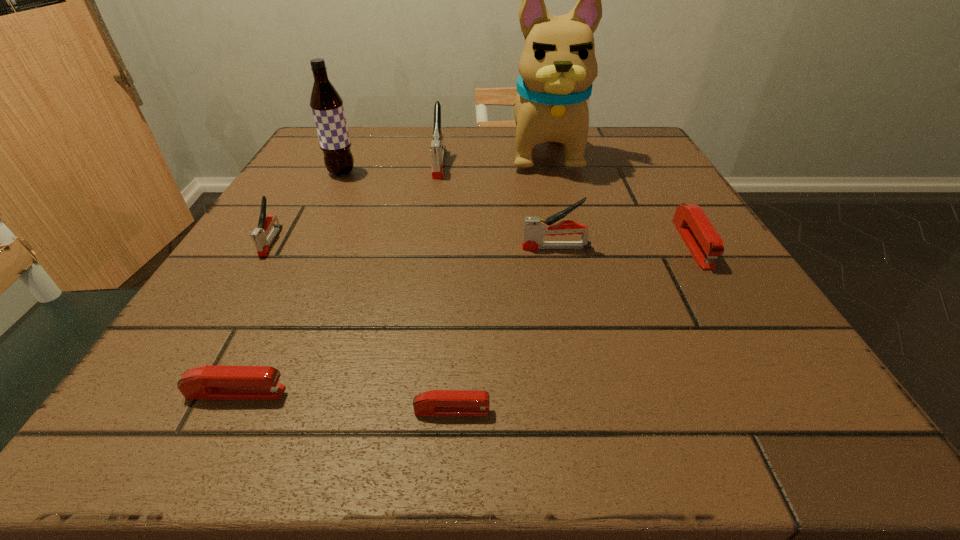
Find the location of a particular element. The height and width of the screenshot is (540, 960). the tallest object is located at coordinates (557, 67).

Locate an element on the screen. Image resolution: width=960 pixels, height=540 pixels. puppy is located at coordinates pos(557,67).

This screenshot has width=960, height=540. I want to click on brown root beer, so click(326, 104).

Find the location of a particular element. the second tallest object is located at coordinates (326, 104).

Where is `the tallest stapler`? The height and width of the screenshot is (540, 960). the tallest stapler is located at coordinates (437, 148).

Locate an element on the screen. This screenshot has width=960, height=540. the farthest stapler is located at coordinates (437, 148).

Find the location of `the rightmost gray stapler`. the rightmost gray stapler is located at coordinates (535, 228).

The image size is (960, 540). I want to click on the fifth shortest object, so click(535, 228).

Find the location of a particular element. This screenshot has width=960, height=540. the fourth shortest object is located at coordinates (262, 244).

Find the location of a particular element. This screenshot has height=540, width=960. the fourth shortest stapler is located at coordinates (262, 244).